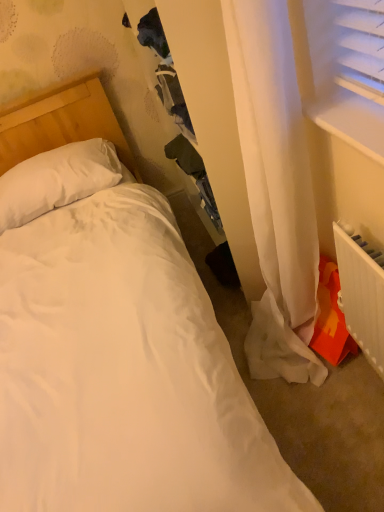
In order to face white plastic radiator at lower right, should I rotate leftwards or rightwards?

Turn right approximately 21.953 degrees to face it.

The height and width of the screenshot is (512, 384). What do you see at coordinates (351, 120) in the screenshot?
I see `white plastic window sill at upper right` at bounding box center [351, 120].

Identify the location of white plastic radiator at lower right. (361, 292).

What's the angular difference between white soft pillow at upper left and white plastic window sill at upper right's facing directions?

91.4 degrees separate the facing orientations of white soft pillow at upper left and white plastic window sill at upper right.

From a real-world perspective, is white soft pillow at upper left above or below white plastic window sill at upper right?

white soft pillow at upper left is situated lower than white plastic window sill at upper right in the real world.

Which point is more forward, (120, 169) or (340, 121)?

The point (340, 121) is more forward.

Which of these two, white soft pillow at upper left or white plastic window sill at upper right, stands shorter?

Standing shorter between the two is white plastic window sill at upper right.

From the image's perspective, is white soft pillow at upper left located beneath white plastic radiator at lower right?

Incorrect, from the image's perspective, white soft pillow at upper left is higher than white plastic radiator at lower right.

Is white soft pillow at upper left behind white plastic radiator at lower right?

Yes, it is.

Measure the distance between white soft pillow at upper left and white plastic radiator at lower right.

A distance of 1.26 meters exists between white soft pillow at upper left and white plastic radiator at lower right.

From a real-world perspective, is white plastic window sill at upper right physically below white plastic radiator at lower right?

No, from a real-world perspective, white plastic window sill at upper right is not under white plastic radiator at lower right.

Considering the sizes of objects white plastic window sill at upper right and white plastic radiator at lower right in the image provided, who is smaller, white plastic window sill at upper right or white plastic radiator at lower right?

white plastic window sill at upper right is smaller.

From the image's perspective, is white plastic window sill at upper right located above or below white plastic radiator at lower right?

white plastic window sill at upper right is situated higher than white plastic radiator at lower right in the image.

Would you say white plastic window sill at upper right is to the left or to the right of white plastic radiator at lower right in the picture?

white plastic window sill at upper right is positioned on white plastic radiator at lower right's left side.

Is white plastic radiator at lower right to the left or to the right of white soft pillow at upper left in the image?

Clearly, white plastic radiator at lower right is on the right of white soft pillow at upper left in the image.

Is white plastic radiator at lower right aimed at white soft pillow at upper left?

No, white plastic radiator at lower right is not facing towards white soft pillow at upper left.

From the image's perspective, which object appears higher, white plastic radiator at lower right or white soft pillow at upper left?

white soft pillow at upper left appears higher in the image.

Which object is closer to the camera, white plastic radiator at lower right or white soft pillow at upper left?

white plastic radiator at lower right.

Which object is further away from the camera, white plastic window sill at upper right or white soft pillow at upper left?

white soft pillow at upper left is more distant.

Considering the points (336, 103) and (60, 206), which point is in front, point (336, 103) or point (60, 206)?

Point (336, 103)

Between white plastic window sill at upper right and white soft pillow at upper left, which one has less height?

Standing shorter between the two is white plastic window sill at upper right.

From the picture: Is white plastic radiator at lower right placed right next to white plastic window sill at upper right?

No, white plastic radiator at lower right is not with white plastic window sill at upper right.

Does white plastic radiator at lower right have a larger size compared to white plastic window sill at upper right?

Correct, white plastic radiator at lower right is larger in size than white plastic window sill at upper right.

From a real-world perspective, does white plastic radiator at lower right sit lower than white plastic window sill at upper right?

Yes, from a real-world perspective, white plastic radiator at lower right is beneath white plastic window sill at upper right.

Find the location of a particular element. The height and width of the screenshot is (512, 384). window sill below the white soft pillow at upper left (from the image's perspective) is located at coordinates (351, 120).

You are a GUI agent. You are given a task and a screenshot of the screen. Output one action in this format:
    pyautogui.click(x=<x>, y=<y>)
    Task: Click on the pillow above the white plastic radiator at lower right (from a real-world perspective)
    
    Given the screenshot: What is the action you would take?
    pyautogui.click(x=56, y=180)

When comparing their distances from white soft pillow at upper left, does white plastic window sill at upper right or white plastic radiator at lower right seem closer?

white plastic window sill at upper right.

Based on the photo, which object lies nearer to the anchor point white soft pillow at upper left, white plastic radiator at lower right or white plastic window sill at upper right?

The object closer to white soft pillow at upper left is white plastic window sill at upper right.

When comparing their distances from white plastic window sill at upper right, does white soft pillow at upper left or white plastic radiator at lower right seem closer?

The object closer to white plastic window sill at upper right is white plastic radiator at lower right.

Which object lies nearer to the anchor point white plastic radiator at lower right, white plastic window sill at upper right or white soft pillow at upper left?

white plastic window sill at upper right is closer to white plastic radiator at lower right.

Considering their positions, is white soft pillow at upper left positioned further to white plastic radiator at lower right than white plastic window sill at upper right?

white soft pillow at upper left lies further to white plastic radiator at lower right than the other object.

When comparing their distances from white plastic window sill at upper right, does white plastic radiator at lower right or white soft pillow at upper left seem closer?

white plastic radiator at lower right is positioned closer to the anchor white plastic window sill at upper right.

Image resolution: width=384 pixels, height=512 pixels. In order to click on window sill situated between white soft pillow at upper left and white plastic radiator at lower right from left to right in this screenshot , I will do `click(351, 120)`.